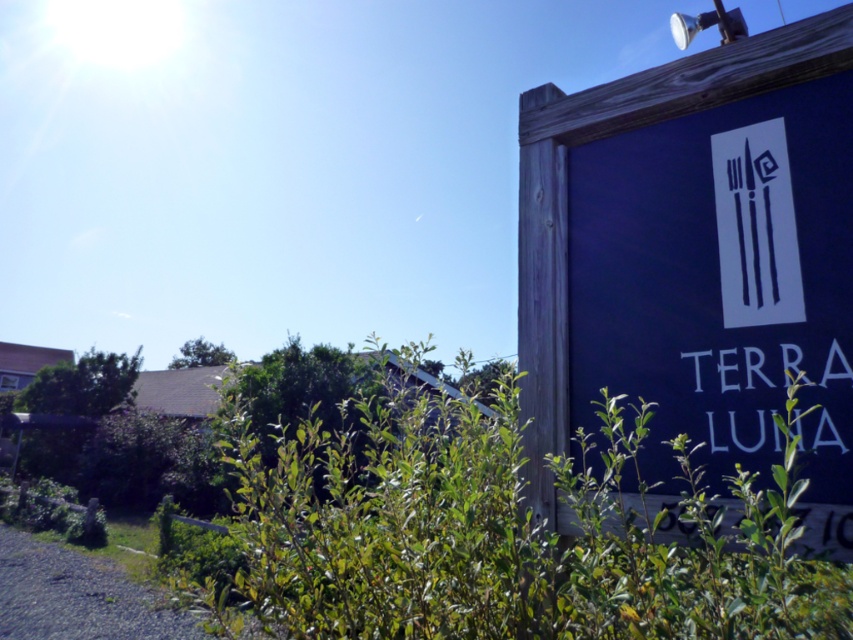
Is dark blue wooden sign at upper right positioned in front of green leafy bush at lower center?

That is False.

Who is taller, dark blue wooden sign at upper right or green leafy bush at lower center?

With more height is green leafy bush at lower center.

Who is more forward, (531, 429) or (697, 625)?

Positioned in front is point (697, 625).

This screenshot has height=640, width=853. I want to click on dark blue wooden sign at upper right, so click(x=695, y=262).